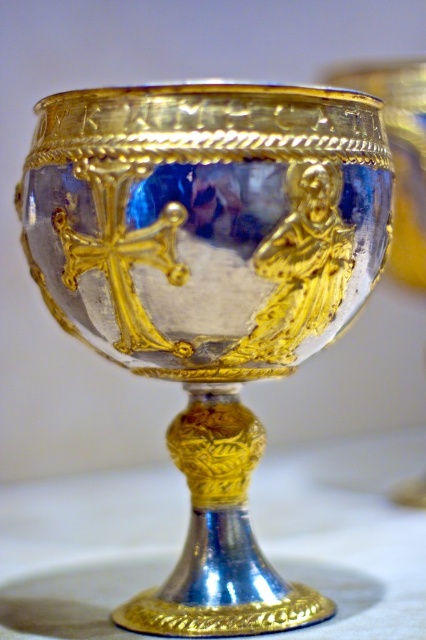
You are standing in a room with a table in front of you. On the table, there is an ornate goblet. A point labeled with coordinates is present at position (x=347, y=532). Based on the scene description, can you determine what object or feature is located at that coordinate?

The point at (x=347, y=532) marks the location of white fabric at center.